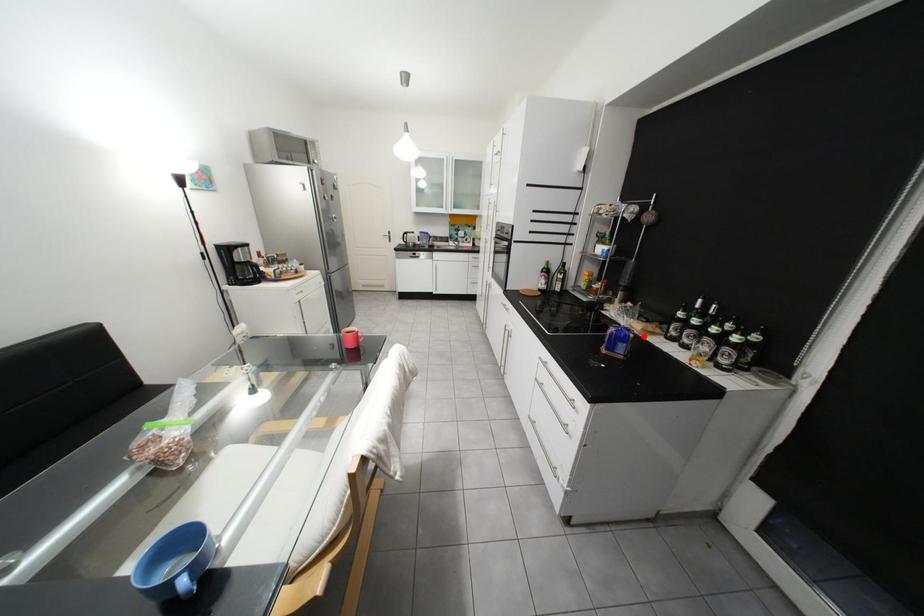
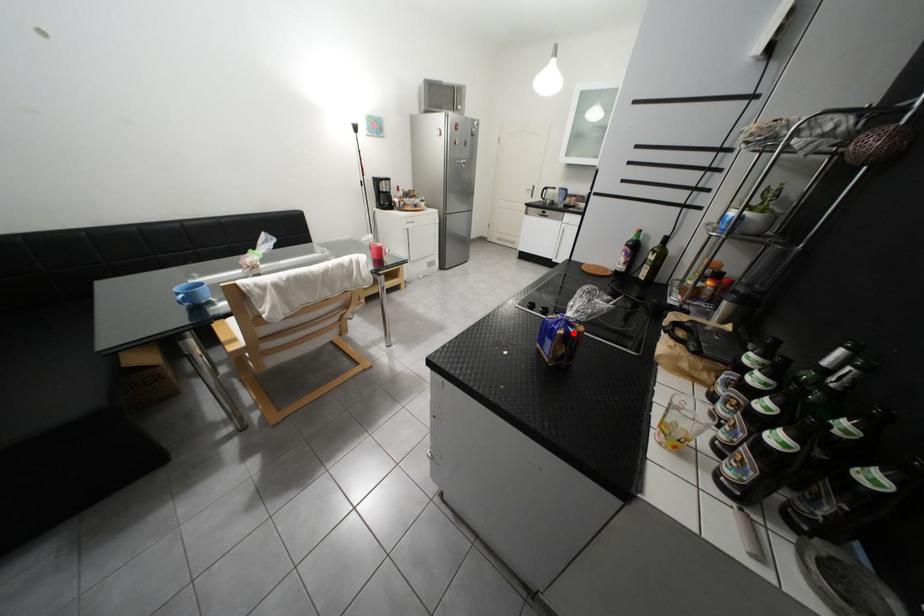
I am providing you with two images of the same scene from different viewpoints. A red point is marked on the first image and another point is marked on the second image. Is the red point in image1 aligned with the point shown in image2?

Yes